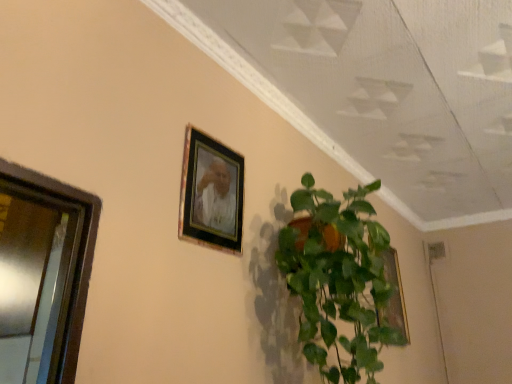
Question: Is wooden frame at upper center, positioned as the 2th picture frame in back-to-front order, positioned behind green glossy plant at center?

Choices:
 (A) no
 (B) yes

Answer: (B)

Question: Would you say green glossy plant at center is part of wooden frame at upper center, which is the first picture frame from front to back,'s contents?

Choices:
 (A) yes
 (B) no

Answer: (B)

Question: Does wooden frame at upper center, the second picture frame in the bottom-to-top sequence, have a larger size compared to green glossy plant at center?

Choices:
 (A) yes
 (B) no

Answer: (B)

Question: Is wooden frame at upper center, the 1th picture frame positioned from the top, closer to the viewer compared to green glossy plant at center?

Choices:
 (A) yes
 (B) no

Answer: (B)

Question: From a real-world perspective, is wooden frame at upper center, the second picture frame in the bottom-to-top sequence, physically below green glossy plant at center?

Choices:
 (A) yes
 (B) no

Answer: (B)

Question: From the image's perspective, is wooden frame at upper center, the second picture frame in the bottom-to-top sequence, on top of green glossy plant at center?

Choices:
 (A) yes
 (B) no

Answer: (A)

Question: Considering the relative positions of metallic glass window at left and gold metallic picture frame at upper right, the first picture frame viewed from the right, in the image provided, is metallic glass window at left to the left of gold metallic picture frame at upper right, the first picture frame viewed from the right, from the viewer's perspective?

Choices:
 (A) no
 (B) yes

Answer: (B)

Question: From a real-world perspective, is metallic glass window at left under gold metallic picture frame at upper right, the first picture frame ordered from the bottom?

Choices:
 (A) yes
 (B) no

Answer: (A)

Question: Is metallic glass window at left oriented away from gold metallic picture frame at upper right, the first picture frame ordered from the bottom?

Choices:
 (A) no
 (B) yes

Answer: (A)

Question: Is metallic glass window at left further to the viewer compared to gold metallic picture frame at upper right, which appears as the second picture frame when viewed from the top?

Choices:
 (A) yes
 (B) no

Answer: (B)

Question: Considering the relative sizes of metallic glass window at left and gold metallic picture frame at upper right, the first picture frame viewed from the right, in the image provided, is metallic glass window at left wider than gold metallic picture frame at upper right, the first picture frame viewed from the right,?

Choices:
 (A) no
 (B) yes

Answer: (B)

Question: Is metallic glass window at left located outside gold metallic picture frame at upper right, the first picture frame ordered from the bottom?

Choices:
 (A) yes
 (B) no

Answer: (A)

Question: From the image's perspective, does green glossy plant at center appear higher than wooden frame at upper center, the second picture frame in the bottom-to-top sequence?

Choices:
 (A) yes
 (B) no

Answer: (B)